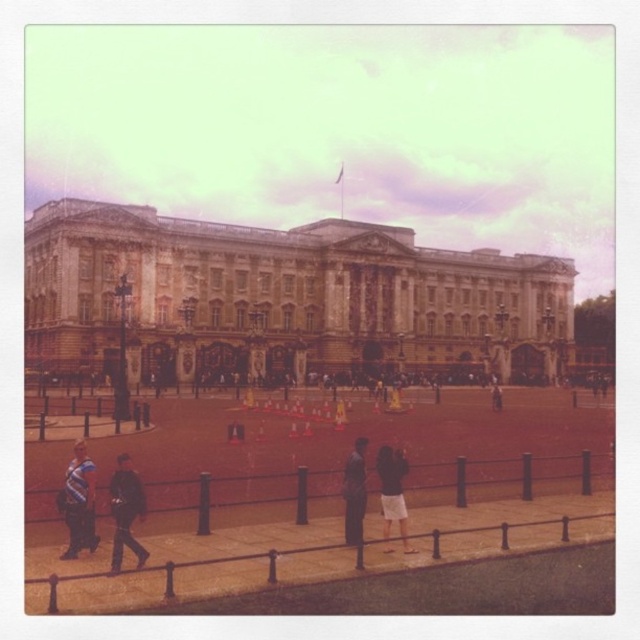
Question: Is brown stone building at center to the left of dark blue leather jacket at lower left from the viewer's perspective?

Choices:
 (A) yes
 (B) no

Answer: (B)

Question: Is brown stone building at center closer to the viewer compared to dark gray coat at center?

Choices:
 (A) yes
 (B) no

Answer: (B)

Question: Which object appears farthest from the camera in this image?

Choices:
 (A) dark gray fabric jacket at center
 (B) dark gray coat at center
 (C) striped shirt at lower left
 (D) dark blue leather jacket at lower left

Answer: (A)

Question: Which of the following is the farthest from the observer?

Choices:
 (A) dark brown skirt at center
 (B) dark gray coat at center
 (C) dark blue leather jacket at lower left
 (D) brown metal fence at lower center

Answer: (B)

Question: Can you confirm if brown metal fence at lower center is positioned to the left of dark brown skirt at center?

Choices:
 (A) yes
 (B) no

Answer: (A)

Question: Which point appears farthest from the camera in this image?

Choices:
 (A) (348, 522)
 (B) (84, 538)

Answer: (A)